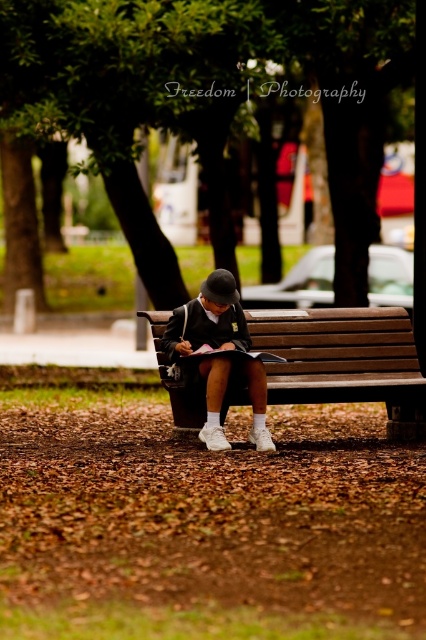
Question: Where is brown wooden bench at center located in relation to white matte uniform at center in the image?

Choices:
 (A) left
 (B) right

Answer: (B)

Question: Is brown wooden bench at center to the left of white matte uniform at center from the viewer's perspective?

Choices:
 (A) yes
 (B) no

Answer: (B)

Question: Is the position of brown wooden bench at center less distant than that of white matte uniform at center?

Choices:
 (A) no
 (B) yes

Answer: (A)

Question: Among these points, which one is nearest to the camera?

Choices:
 (A) (340, 349)
 (B) (213, 276)

Answer: (B)

Question: Which object appears closest to the camera in this image?

Choices:
 (A) brown wooden bench at center
 (B) white matte uniform at center

Answer: (B)